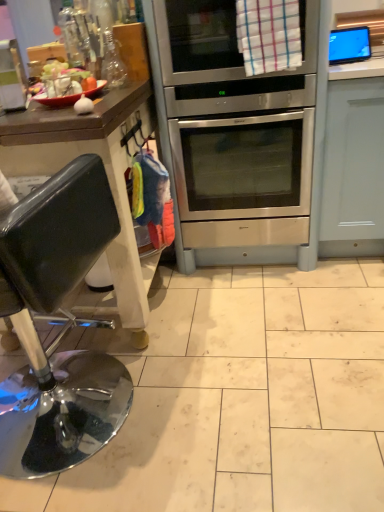
Describe the element at coordinates (349, 45) in the screenshot. I see `flat screen tv at upper right` at that location.

This screenshot has height=512, width=384. In order to click on matte glass bowl at upper left in this screenshot , I will do `click(66, 85)`.

Does stainless steel oven at center have a lesser width compared to flat screen tv at upper right?

In fact, stainless steel oven at center might be wider than flat screen tv at upper right.

Is stainless steel oven at center outside of flat screen tv at upper right?

Yes, stainless steel oven at center is not within flat screen tv at upper right.

Identify the location of oven on the left of flat screen tv at upper right. This screenshot has width=384, height=512. (232, 134).

From a real-world perspective, is matte glass bowl at upper left above or below shiny black stool at left?

Clearly, from a real-world perspective, matte glass bowl at upper left is above shiny black stool at left.

Does matte glass bowl at upper left come behind shiny black stool at left?

Yes, matte glass bowl at upper left is further from the camera.

In terms of height, does flat screen tv at upper right look taller or shorter compared to stainless steel oven at center?

In the image, flat screen tv at upper right appears to be shorter than stainless steel oven at center.

Which of these two, flat screen tv at upper right or stainless steel oven at center, is smaller?

flat screen tv at upper right.

Is flat screen tv at upper right in front of or behind stainless steel oven at center in the image?

flat screen tv at upper right is behind stainless steel oven at center.

From the picture: Is flat screen tv at upper right in front of or behind shiny black stool at left in the image?

In the image, flat screen tv at upper right appears behind shiny black stool at left.

From the image's perspective, between flat screen tv at upper right and shiny black stool at left, who is located below?

shiny black stool at left appears lower in the image.

Which is closer to the camera, (354,40) or (84,459)?

Point (354,40).

Are matte glass bowl at upper left and stainless steel oven at center located far from each other?

No, matte glass bowl at upper left is not far from stainless steel oven at center.

The width and height of the screenshot is (384, 512). Identify the location of oven on the right side of matte glass bowl at upper left. (232, 134).

Is matte glass bowl at upper left to the right of stainless steel oven at center from the viewer's perspective?

In fact, matte glass bowl at upper left is to the left of stainless steel oven at center.

Which is more to the right, stainless steel oven at center or matte glass bowl at upper left?

stainless steel oven at center.

Which point is more distant from viewer, (256, 251) or (79, 73)?

The point (256, 251) is farther.

Between stainless steel oven at center and matte glass bowl at upper left, which one is positioned in front?

matte glass bowl at upper left is more forward.

The height and width of the screenshot is (512, 384). What are the coordinates of `food that appears in front of the stainless steel oven at center` in the screenshot? It's located at (66, 85).

Which object is positioned more to the left, shiny black stool at left or matte glass bowl at upper left?

shiny black stool at left is more to the left.

From the picture: Is shiny black stool at left facing towards matte glass bowl at upper left?

Yes, shiny black stool at left is turned towards matte glass bowl at upper left.

Is shiny black stool at left situated inside matte glass bowl at upper left or outside?

shiny black stool at left exists outside the volume of matte glass bowl at upper left.

Find the location of `oven that is on the left side of flat screen tv at upper right`. oven that is on the left side of flat screen tv at upper right is located at coordinates (232, 134).

Identify the location of food behind the shiny black stool at left. This screenshot has width=384, height=512. (66, 85).

From the image, which object appears to be farther from matte glass bowl at upper left, shiny black stool at left or stainless steel oven at center?

Based on the image, shiny black stool at left appears to be further to matte glass bowl at upper left.

Consider the image. When comparing their distances from shiny black stool at left, does matte glass bowl at upper left or flat screen tv at upper right seem further?

flat screen tv at upper right.

From the image, which object appears to be farther from shiny black stool at left, stainless steel oven at center or flat screen tv at upper right?

flat screen tv at upper right.

When comparing their distances from shiny black stool at left, does stainless steel oven at center or matte glass bowl at upper left seem closer?

matte glass bowl at upper left is positioned closer to the anchor shiny black stool at left.

In the scene shown: Estimate the real-world distances between objects in this image. Which object is further from stainless steel oven at center, shiny black stool at left or matte glass bowl at upper left?

shiny black stool at left is further to stainless steel oven at center.

Looking at the image, which one is located closer to matte glass bowl at upper left, flat screen tv at upper right or shiny black stool at left?

shiny black stool at left is positioned closer to the anchor matte glass bowl at upper left.

Looking at the image, which one is located further to matte glass bowl at upper left, stainless steel oven at center or flat screen tv at upper right?

The object further to matte glass bowl at upper left is flat screen tv at upper right.

From the image, which object appears to be nearer to flat screen tv at upper right, shiny black stool at left or stainless steel oven at center?

stainless steel oven at center lies closer to flat screen tv at upper right than the other object.

Locate an element on the screen. This screenshot has height=512, width=384. food between shiny black stool at left and stainless steel oven at center in the front-back direction is located at coordinates (66, 85).

This screenshot has height=512, width=384. What are the coordinates of `oven between matte glass bowl at upper left and flat screen tv at upper right from left to right` in the screenshot? It's located at (232, 134).

Identify the location of food between shiny black stool at left and flat screen tv at upper right in the horizontal direction. This screenshot has height=512, width=384. (66, 85).

Where is `oven between shiny black stool at left and flat screen tv at upper right`? The image size is (384, 512). oven between shiny black stool at left and flat screen tv at upper right is located at coordinates (232, 134).